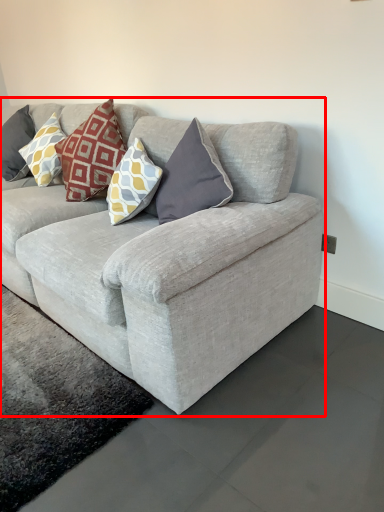
Question: From the image's perspective, what is the correct spatial positioning of studio couch (annotated by the red box) in reference to pillow?

Choices:
 (A) above
 (B) below

Answer: (B)